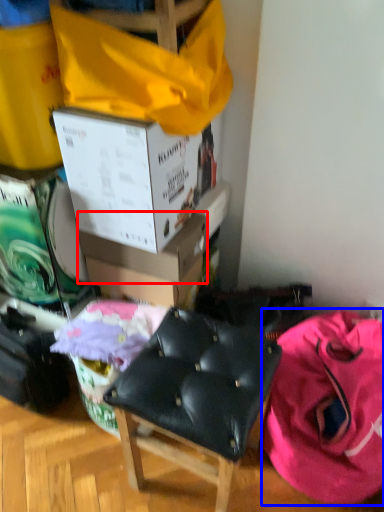
Question: Which point is closer to the camera, box (highlighted by a red box) or clothing (highlighted by a blue box)?

Choices:
 (A) box
 (B) clothing

Answer: (B)